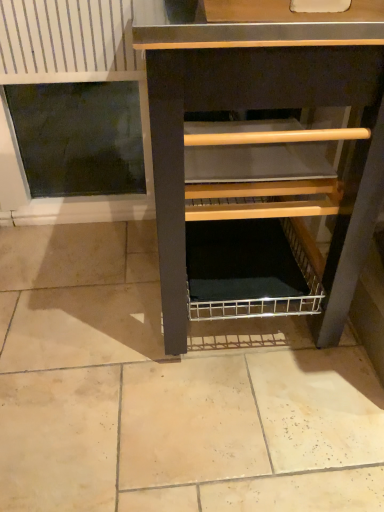
This screenshot has height=512, width=384. Find the location of `free space in front of metallic silver shelf at center`. free space in front of metallic silver shelf at center is located at coordinates (218, 423).